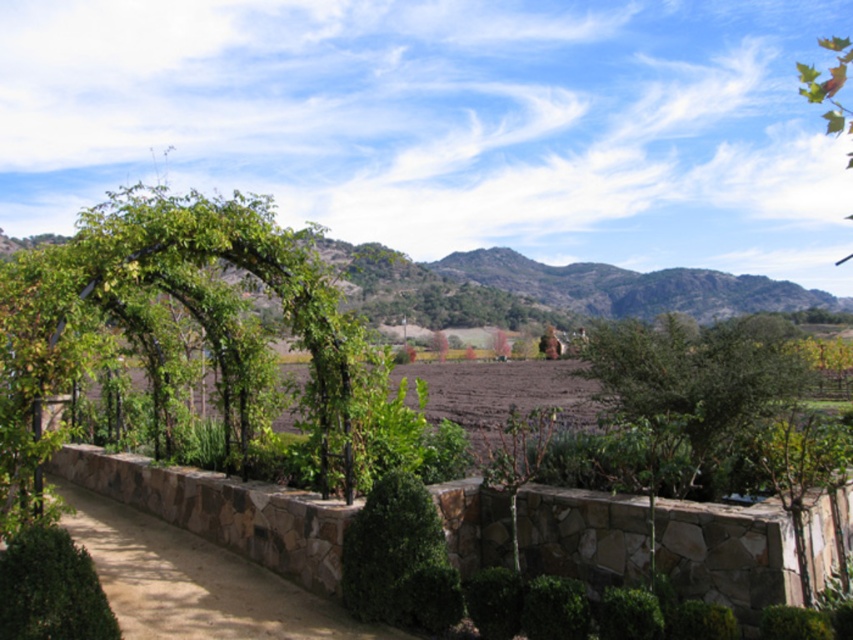
In the scene shown: You are standing at the entrance of the garden and see the green leafy tree at center and the green leafy bush at lower left. Which one is closer to the left side of the garden?

The green leafy bush at lower left is closer to the left side of the garden since it is positioned to the left of the green leafy tree at center.

You are planning to plant a new flower bed between the green leafy tree at center and the green leafy bush at lower left. Considering their sizes, which one might cast more shade over the flower bed during the afternoon?

The green leafy tree at center is taller than the green leafy bush at lower left, so it will cast a larger shadow and provide more shade over the flower bed during the afternoon.